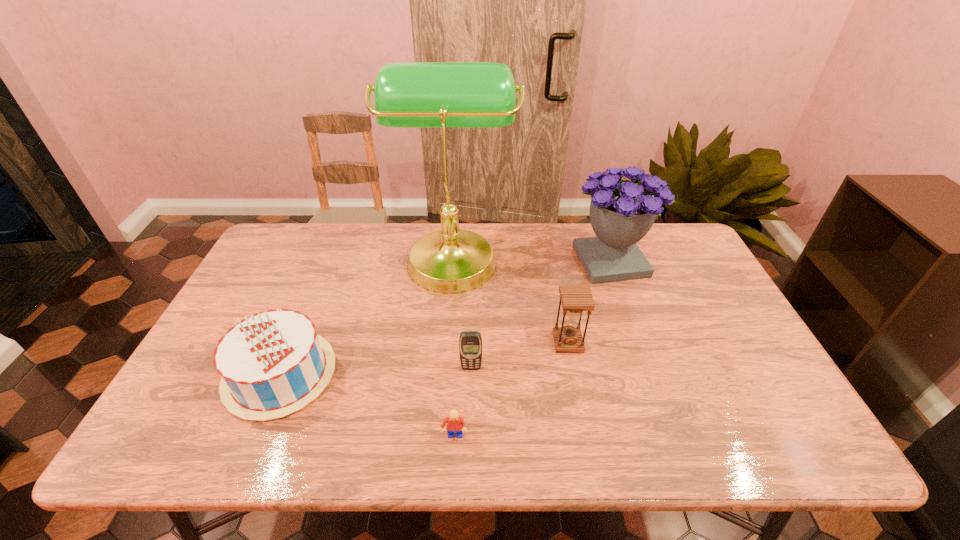
Image resolution: width=960 pixels, height=540 pixels. In order to click on unoccupied position between the lamp and the nearest object in this screenshot , I will do `click(453, 347)`.

In order to click on vacant space that is in between the hourglass and the Lego in this screenshot , I will do `click(511, 389)`.

You are a GUI agent. You are given a task and a screenshot of the screen. Output one action in this format:
    pyautogui.click(x=<x>, y=<y>)
    Task: Click on the free spot between the tallest object and the birthday cake
    The height and width of the screenshot is (540, 960).
    Given the screenshot: What is the action you would take?
    pyautogui.click(x=367, y=315)

The width and height of the screenshot is (960, 540). Find the location of `empty space between the nearest object and the fifth object from left to right`. empty space between the nearest object and the fifth object from left to right is located at coordinates (511, 389).

Locate which object ranks fifth in proximity to the leftmost object. Please provide its 2D coordinates. Your answer should be formatted as a tuple, i.e. [(x, y)], where the tuple contains the x and y coordinates of a point satisfying the conditions above.

[(622, 212)]

Select which object is the second closest to the cellular telephone. Please provide its 2D coordinates. Your answer should be formatted as a tuple, i.e. [(x, y)], where the tuple contains the x and y coordinates of a point satisfying the conditions above.

[(575, 299)]

This screenshot has height=540, width=960. What are the coordinates of `vacant space that satisfies the following two spatial constraints: 1. on the back side of the fifth object from left to right; 2. on the desk next to the lamp` in the screenshot? It's located at (551, 256).

Identify the location of blank space that satisfies the following two spatial constraints: 1. on the desk next to the tallest object; 2. on the back side of the fifth shortest object. (452, 261).

Find the location of a particular element. Image resolution: width=960 pixels, height=540 pixels. blank area in the image that satisfies the following two spatial constraints: 1. on the desk next to the fifth object from left to right; 2. on the left side of the tallest object is located at coordinates (445, 342).